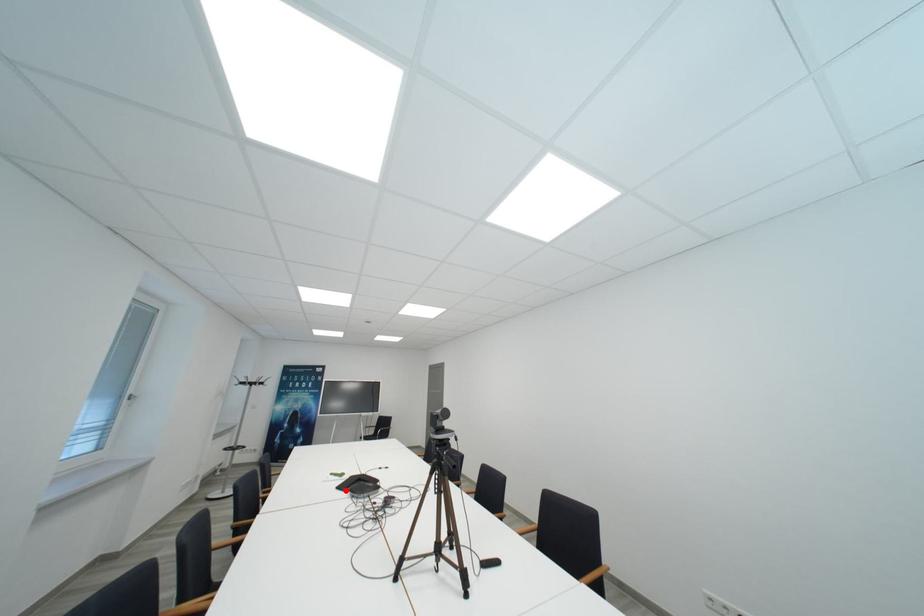
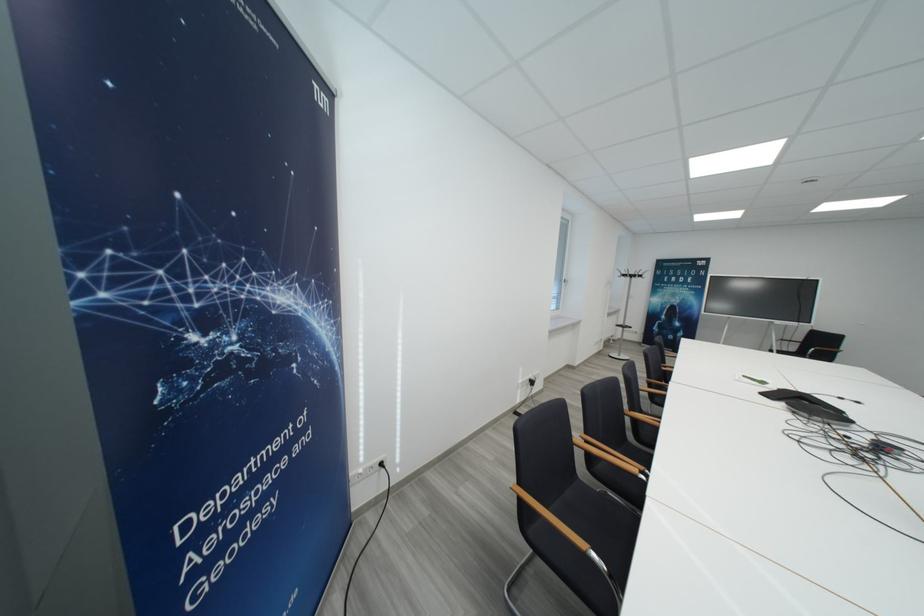
Question: I am providing you with two images of the same scene from different viewpoints. A red point is marked on the first image. Can you still see the location of the red point in image 2?

Choices:
 (A) Yes
 (B) No

Answer: (A)